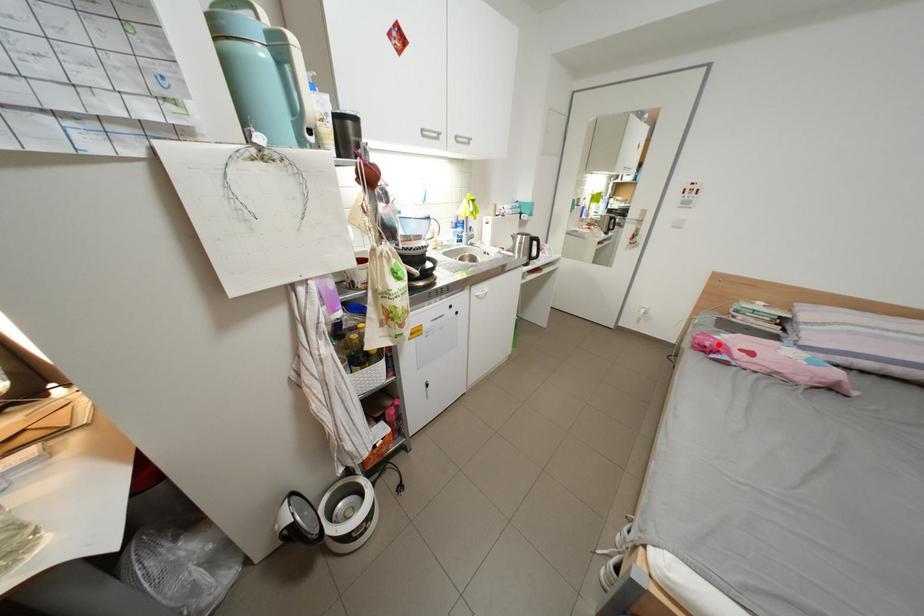
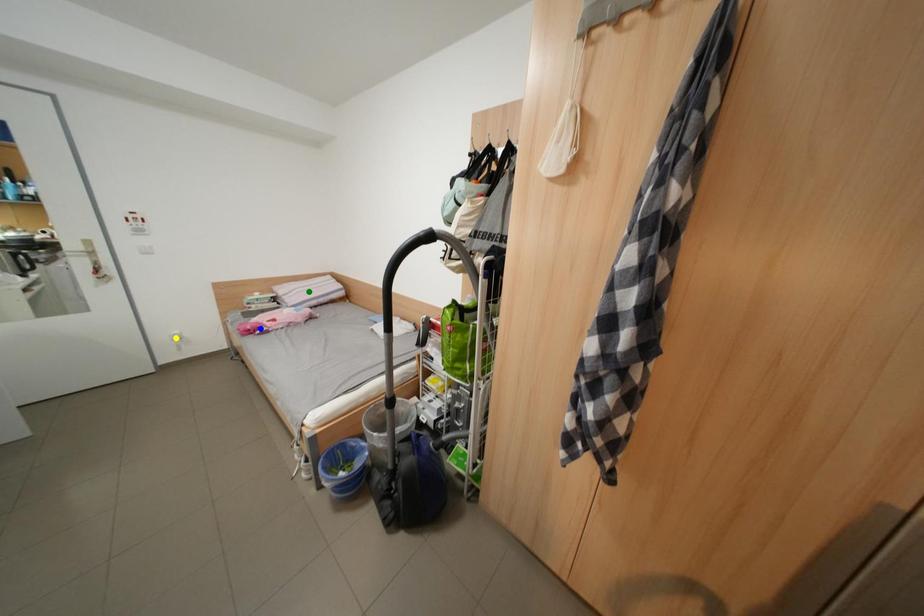
Question: I am providing you with two images of the same scene from different viewpoints. A red point is marked on the first image. You are given multiple points on the second image. Which spot in image 2 lines up with the point in image 1?

Choices:
 (A) blue point
 (B) yellow point
 (C) green point

Answer: (A)